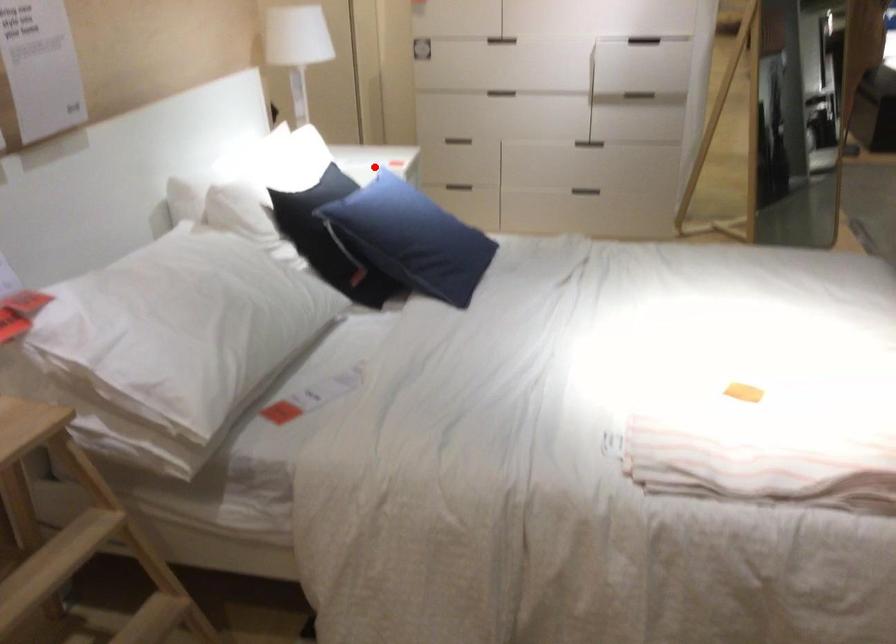
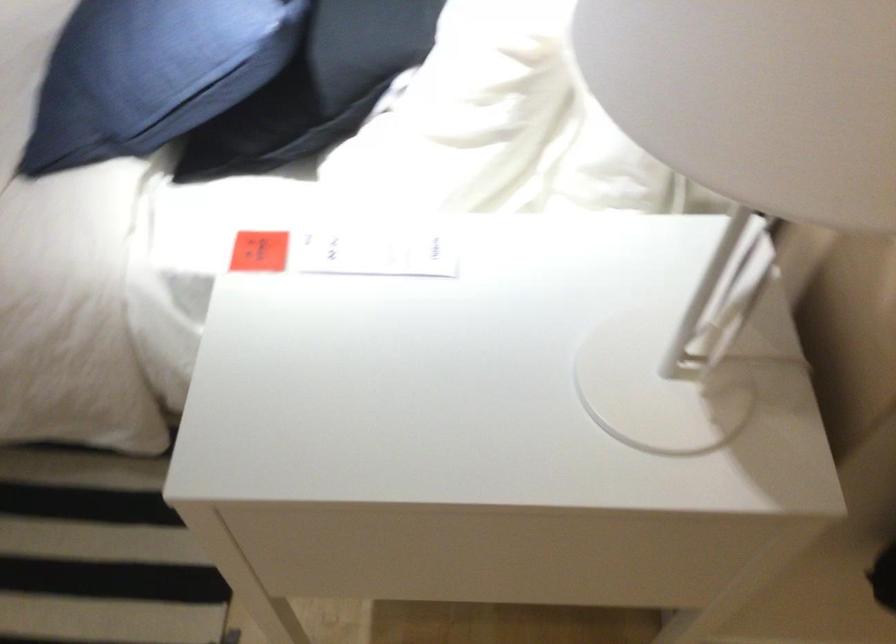
Question: I am providing you with two images of the same scene from different viewpoints. Given a red point in image1, look at the same physical point in image2. Is it:

Choices:
 (A) Closer to the viewpoint
 (B) Farther from the viewpoint

Answer: (A)